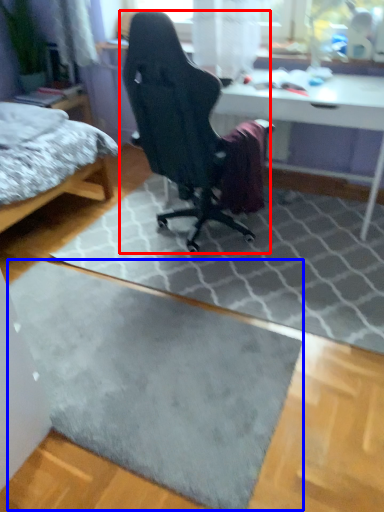
Question: Among these objects, which one is nearest to the camera, chair (highlighted by a red box) or doormat (highlighted by a blue box)?

Choices:
 (A) chair
 (B) doormat

Answer: (B)